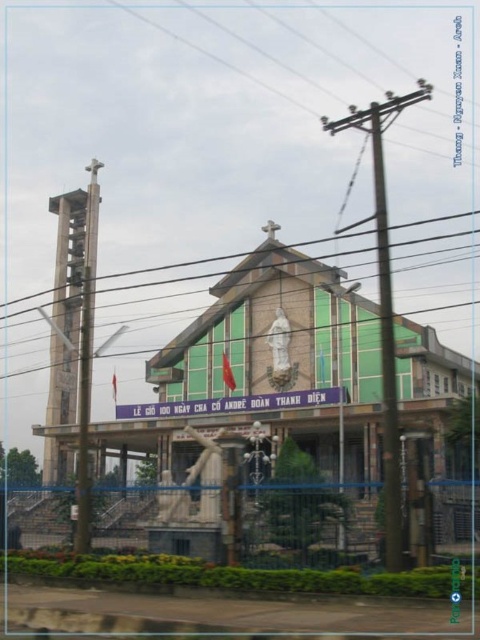
Question: Is green stone church at center smaller than brown wooden telegraph pole at upper center?

Choices:
 (A) yes
 (B) no

Answer: (B)

Question: Is brown wooden telegraph pole at upper center below metallic gray telegraph pole at left?

Choices:
 (A) no
 (B) yes

Answer: (A)

Question: Which is farther from the green stone church at center?

Choices:
 (A) metallic gray telegraph pole at left
 (B) brown wooden telegraph pole at upper center

Answer: (A)

Question: Is the position of green stone church at center less distant than that of brown wooden telegraph pole at upper center?

Choices:
 (A) no
 (B) yes

Answer: (A)

Question: Estimate the real-world distances between objects in this image. Which object is farther from the brown wooden telegraph pole at upper center?

Choices:
 (A) metallic gray telegraph pole at left
 (B) green stone church at center

Answer: (A)

Question: Which of the following is the farthest from the observer?

Choices:
 (A) (84, 321)
 (B) (394, 358)

Answer: (A)